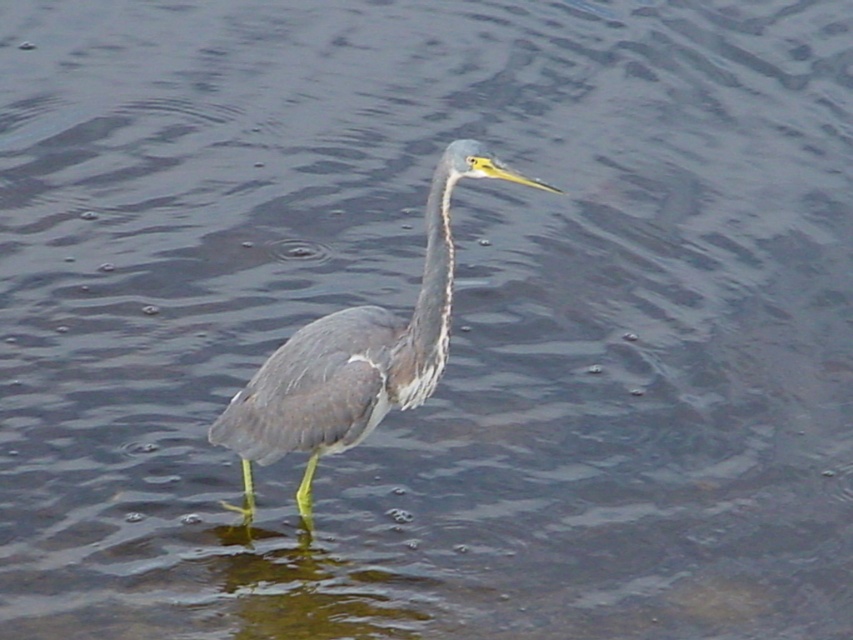
You are a wildlife photographer aiming to capture the gray matte heron at center and the gray matte neck at center in a single frame. Which of the two objects is wider?

The gray matte heron at center is wider than the gray matte neck at center.

You are a photographer trying to capture the heron in the image. You have a camera with a zoom lens that can focus on a specific point. The point you want to focus on is point (355, 355). According to the scene, where exactly is this point located on the heron?

The point (355, 355) is located on the gray matte heron at center.

You are a nature photographer observing the gray matte heron at center and the gray matte neck at center in the image. Which object would appear larger in your camera frame?

The gray matte heron at center is bigger than the gray matte neck at center, so the gray matte heron at center would appear larger in the camera frame.